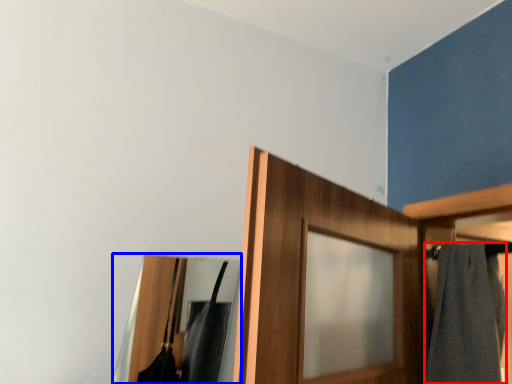
Question: Which object is further to the camera taking this photo, bath towel (highlighted by a red box) or mirror (highlighted by a blue box)?

Choices:
 (A) bath towel
 (B) mirror

Answer: (A)